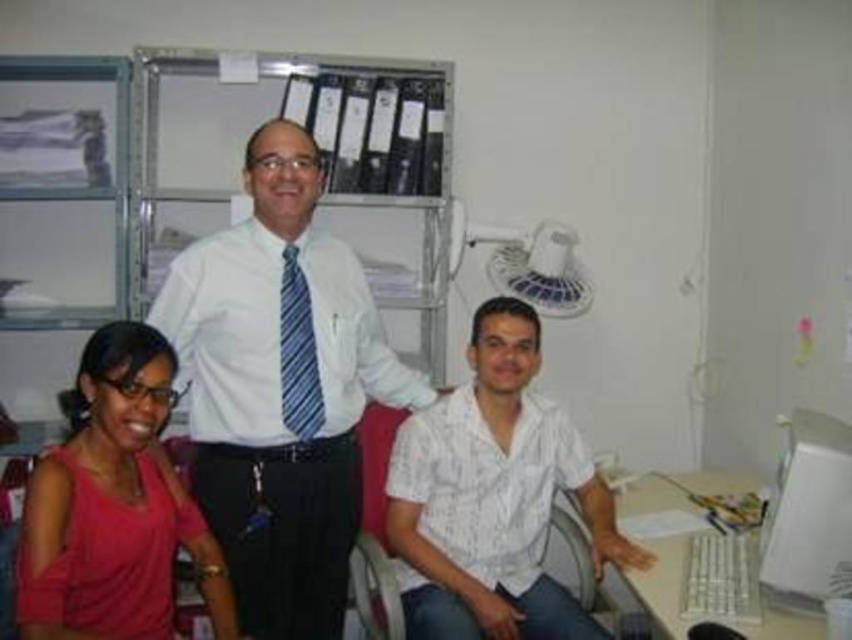
Question: Does white smooth shirt at center appear under white plastic computer desk at lower right?

Choices:
 (A) no
 (B) yes

Answer: (A)

Question: Which object appears closest to the camera in this image?

Choices:
 (A) white plastic computer desk at lower right
 (B) blue striped tie at center
 (C) pink matte shirt at lower left
 (D) white plastic monitor at right

Answer: (C)

Question: In this image, where is white plastic monitor at right located relative to blue striped tie at center?

Choices:
 (A) below
 (B) above

Answer: (A)

Question: Based on their relative distances, which object is nearer to the white plastic computer desk at lower right?

Choices:
 (A) white plastic monitor at right
 (B) pink matte shirt at lower left

Answer: (A)

Question: Is the position of white smooth shirt at center more distant than that of white textured shirt at center?

Choices:
 (A) no
 (B) yes

Answer: (A)

Question: Which of the following is the farthest from the observer?

Choices:
 (A) (711, 476)
 (B) (85, 467)
 (C) (211, 262)

Answer: (A)